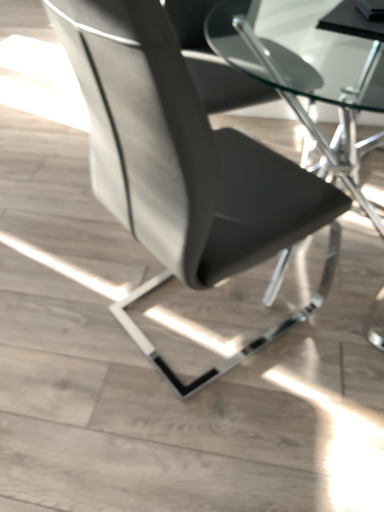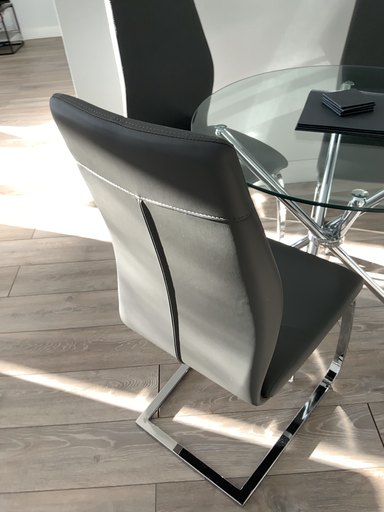
Question: How did the camera likely rotate when shooting the video?

Choices:
 (A) rotated right
 (B) rotated left

Answer: (A)